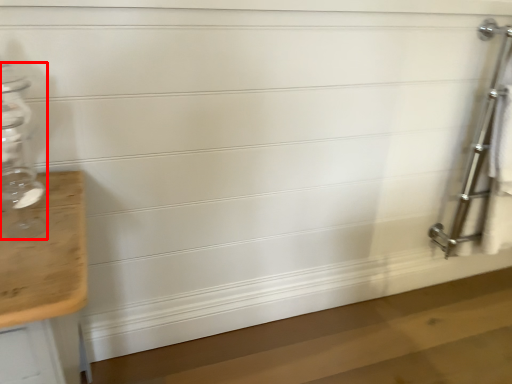
Question: From the image's perspective, what is the correct spatial positioning of glass bottle (annotated by the red box) in reference to ladder?

Choices:
 (A) above
 (B) below

Answer: (B)